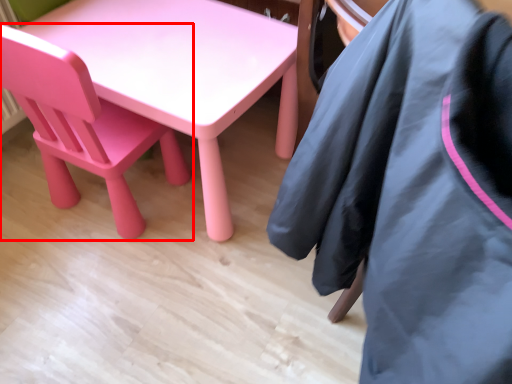
Question: In this image, where is chair (annotated by the red box) located relative to jacket?

Choices:
 (A) right
 (B) left

Answer: (B)